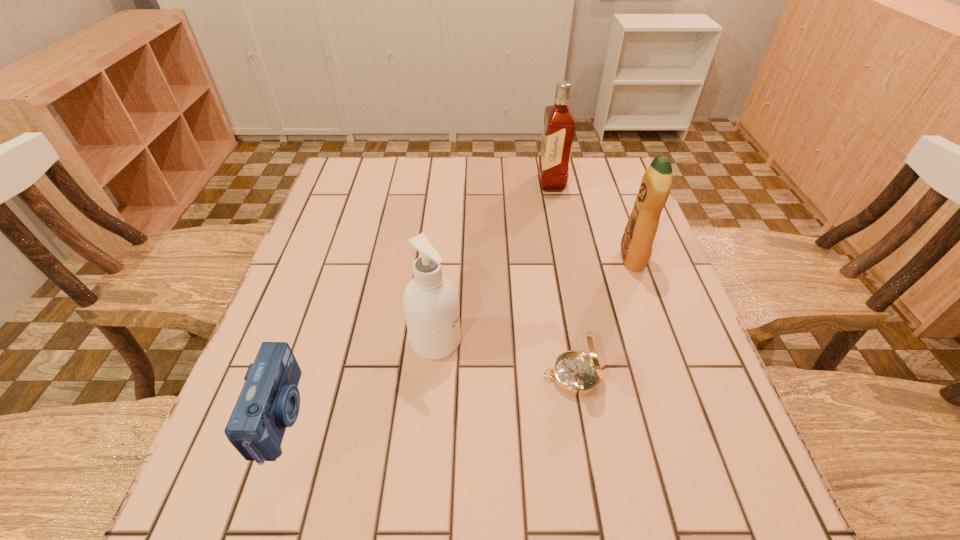
Where is `vacant area at the far edge of the desktop`? The width and height of the screenshot is (960, 540). vacant area at the far edge of the desktop is located at coordinates (538, 163).

This screenshot has width=960, height=540. Identify the location of vacant region at the near edge of the desktop. (549, 494).

In the image, there is a desktop. Where is `vacant space at the left edge`? vacant space at the left edge is located at coordinates (294, 279).

Where is `free space at the right edge`? The height and width of the screenshot is (540, 960). free space at the right edge is located at coordinates (695, 402).

What are the coordinates of `blank area at the far left corner` in the screenshot? It's located at (343, 180).

Locate an element on the screen. This screenshot has height=540, width=960. free spot at the near left corner of the desktop is located at coordinates (226, 478).

In order to click on free location at the far right corner in this screenshot , I will do `click(611, 172)`.

Image resolution: width=960 pixels, height=540 pixels. Find the location of `unoccupied position between the liquor and the compass`. unoccupied position between the liquor and the compass is located at coordinates (563, 279).

Locate an element on the screen. This screenshot has height=540, width=960. vacant space that is in between the camera and the compass is located at coordinates (426, 396).

Identify the location of empty space between the farthest object and the cleansing agent. (493, 262).